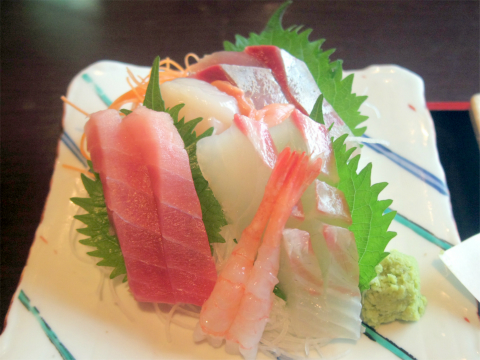
Find the location of `stripes on plate`. stripes on plate is located at coordinates (51, 343), (387, 347), (413, 227), (403, 165).